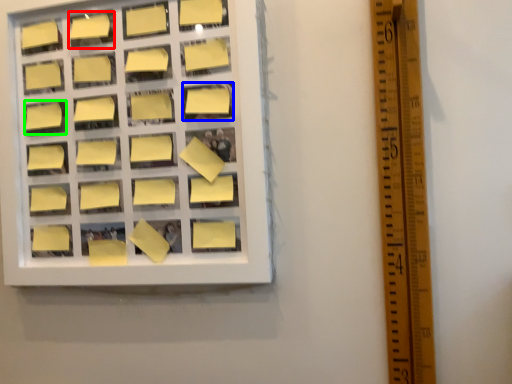
Question: Which object is the farthest from square (highlighted by a red box)? Choose among these: square (highlighted by a blue box) or square (highlighted by a green box).

Choices:
 (A) square
 (B) square

Answer: (A)